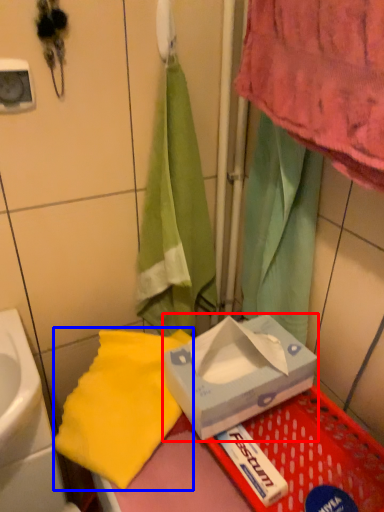
Question: Which object is closer to the camera taking this photo, box (highlighted by a red box) or beach towel (highlighted by a blue box)?

Choices:
 (A) box
 (B) beach towel

Answer: (A)